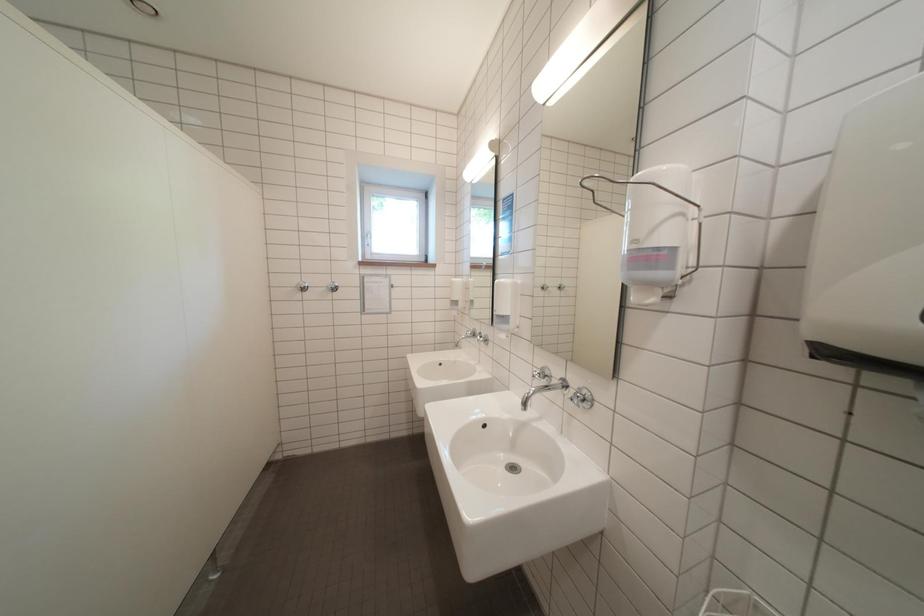
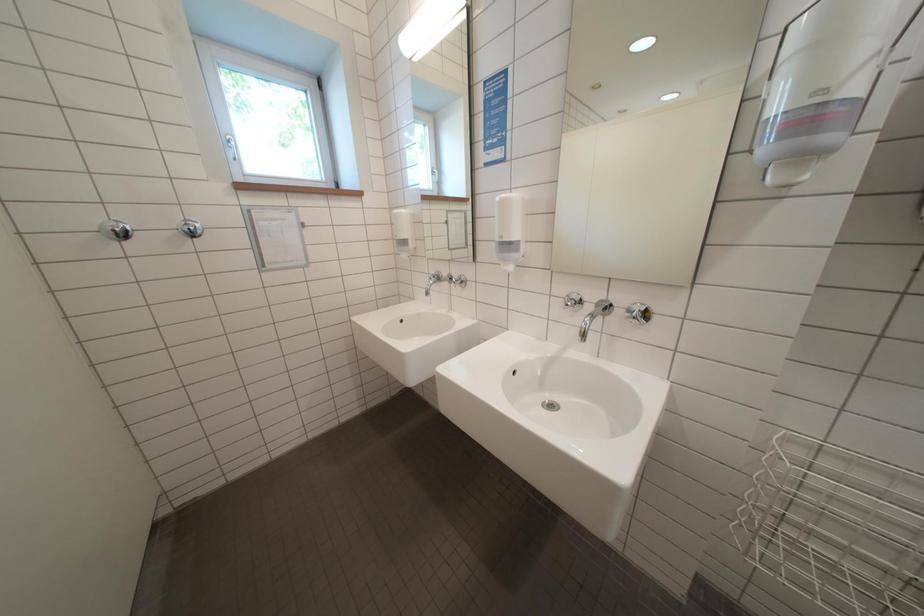
The images are taken continuously from a first-person perspective. In which direction are you moving?

The cameraman walked toward left, forward.